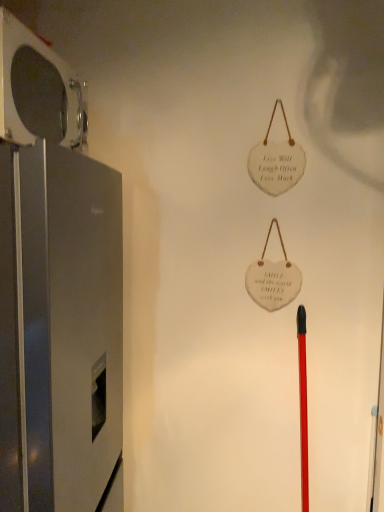
Question: Is satin silver refrigerator at left, the 1th appliance when ordered from bottom to top, at the back of metallic gray refrigerator at left, which appears as the 2th appliance when ordered from the bottom?

Choices:
 (A) no
 (B) yes

Answer: (A)

Question: From a real-world perspective, does metallic gray refrigerator at left, which appears as the first appliance when viewed from the top, sit lower than satin silver refrigerator at left, the second appliance positioned from the top?

Choices:
 (A) yes
 (B) no

Answer: (B)

Question: Considering the relative sizes of metallic gray refrigerator at left, which appears as the 2th appliance when ordered from the bottom, and satin silver refrigerator at left, the 1th appliance when ordered from bottom to top, in the image provided, is metallic gray refrigerator at left, which appears as the 2th appliance when ordered from the bottom, wider than satin silver refrigerator at left, the 1th appliance when ordered from bottom to top,?

Choices:
 (A) yes
 (B) no

Answer: (B)

Question: Are metallic gray refrigerator at left, which appears as the first appliance when viewed from the top, and satin silver refrigerator at left, the second appliance positioned from the top, beside each other?

Choices:
 (A) no
 (B) yes

Answer: (A)

Question: Is metallic gray refrigerator at left, which appears as the first appliance when viewed from the top, at the right side of satin silver refrigerator at left, the 1th appliance when ordered from bottom to top?

Choices:
 (A) no
 (B) yes

Answer: (A)

Question: From the image's perspective, would you say metallic gray refrigerator at left, which appears as the 2th appliance when ordered from the bottom, is shown under satin silver refrigerator at left, the second appliance positioned from the top?

Choices:
 (A) no
 (B) yes

Answer: (A)

Question: Is satin silver refrigerator at left, the second appliance positioned from the top, shorter than metallic gray refrigerator at left, which appears as the first appliance when viewed from the top?

Choices:
 (A) no
 (B) yes

Answer: (A)

Question: Does satin silver refrigerator at left, the second appliance positioned from the top, have a greater height compared to metallic gray refrigerator at left, which appears as the 2th appliance when ordered from the bottom?

Choices:
 (A) yes
 (B) no

Answer: (A)

Question: Are satin silver refrigerator at left, the 1th appliance when ordered from bottom to top, and metallic gray refrigerator at left, which appears as the first appliance when viewed from the top, far apart?

Choices:
 (A) no
 (B) yes

Answer: (A)

Question: From the image's perspective, is satin silver refrigerator at left, the 1th appliance when ordered from bottom to top, on metallic gray refrigerator at left, which appears as the 2th appliance when ordered from the bottom?

Choices:
 (A) no
 (B) yes

Answer: (A)

Question: Is satin silver refrigerator at left, the second appliance positioned from the top, behind metallic gray refrigerator at left, which appears as the first appliance when viewed from the top?

Choices:
 (A) no
 (B) yes

Answer: (A)

Question: Would you say satin silver refrigerator at left, the second appliance positioned from the top, is outside metallic gray refrigerator at left, which appears as the first appliance when viewed from the top?

Choices:
 (A) yes
 (B) no

Answer: (A)

Question: In the image, is metallic gray refrigerator at left, which appears as the first appliance when viewed from the top, positioned in front of or behind satin silver refrigerator at left, the second appliance positioned from the top?

Choices:
 (A) behind
 (B) front

Answer: (A)